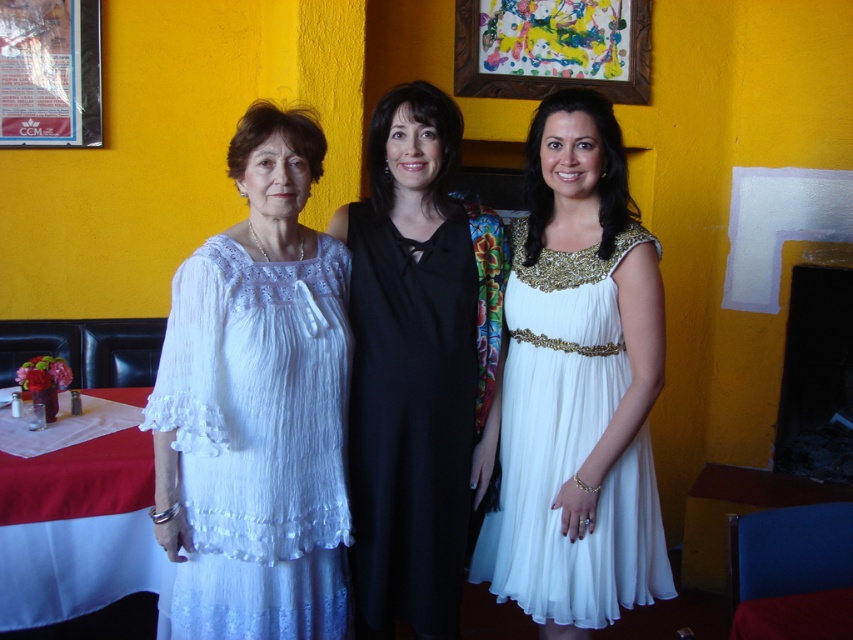
Question: Is white cloth at lower left smaller than red cloth at lower left?

Choices:
 (A) no
 (B) yes

Answer: (A)

Question: Which point is closer to the camera?

Choices:
 (A) plastic poster at upper left
 (B) white cloth at lower left
 (C) black satin dress at center

Answer: (C)

Question: Does white chiffon dress at center appear on the right side of red cloth at lower left?

Choices:
 (A) no
 (B) yes

Answer: (A)

Question: Can you confirm if white sheer dress at left is bigger than painted wood picture frame at upper center?

Choices:
 (A) no
 (B) yes

Answer: (B)

Question: Which point is farther to the camera?

Choices:
 (A) white chiffon dress at center
 (B) white sheer dress at left
 (C) black satin dress at center

Answer: (C)

Question: Which object is positioned closest to the red cloth at lower left?

Choices:
 (A) white chiffon dress at center
 (B) white cloth at lower left
 (C) plastic poster at upper left

Answer: (A)